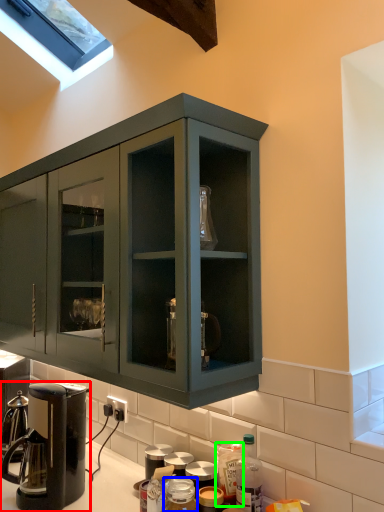
Question: Which object is positioned closest to coffee maker (highlighted by a red box)? Select from bottle (highlighted by a blue box) and bottle (highlighted by a green box).

Choices:
 (A) bottle
 (B) bottle

Answer: (A)